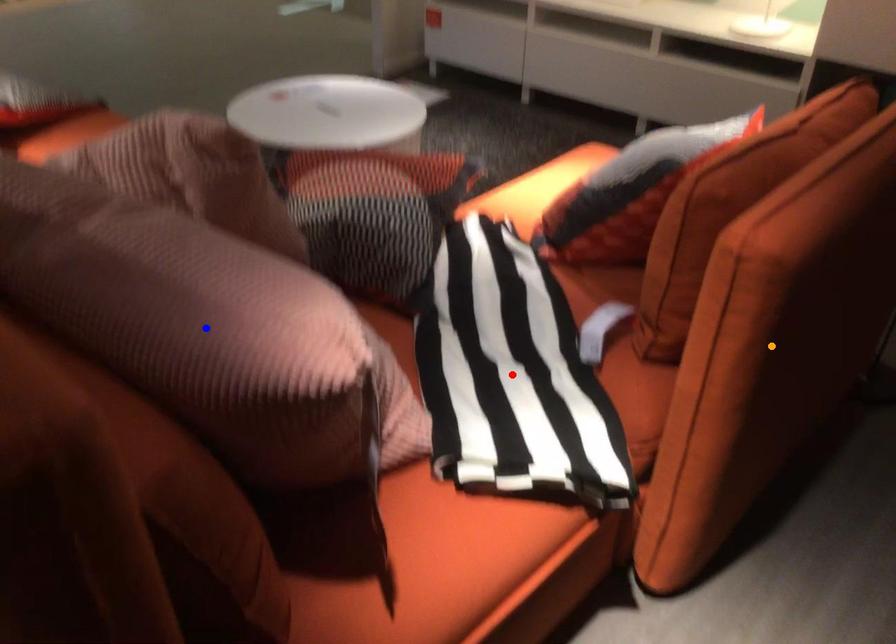
Order these from farthest to nearest:
1. red point
2. blue point
3. orange point

1. red point
2. orange point
3. blue point